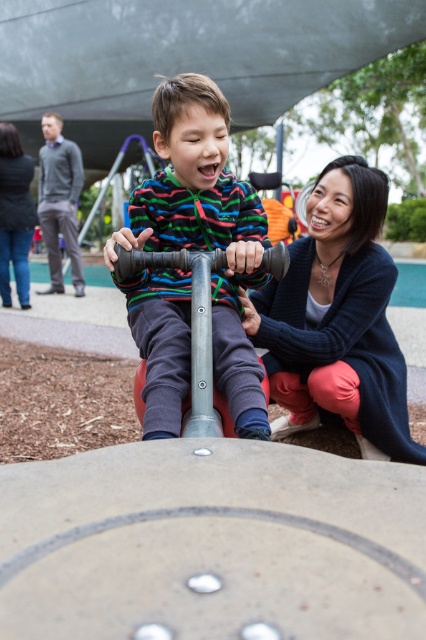
Question: Does matte plastic scooter at center have a larger size compared to dark blue sweater at lower right?

Choices:
 (A) no
 (B) yes

Answer: (A)

Question: Is matte plastic scooter at center above dark blue sweater at lower right?

Choices:
 (A) no
 (B) yes

Answer: (A)

Question: Which of the following is the farthest from the observer?

Choices:
 (A) dark blue sweater at lower right
 (B) blue sweater at center

Answer: (A)

Question: Which of these objects is positioned closest to the matte plastic scooter at center?

Choices:
 (A) dark blue sweater at lower right
 (B) blue sweater at center

Answer: (B)

Question: Does blue sweater at center lie behind dark blue sweater at lower right?

Choices:
 (A) yes
 (B) no

Answer: (B)

Question: Which point is closer to the camera?

Choices:
 (A) (25, 248)
 (B) (304, 285)
 (C) (244, 220)

Answer: (C)